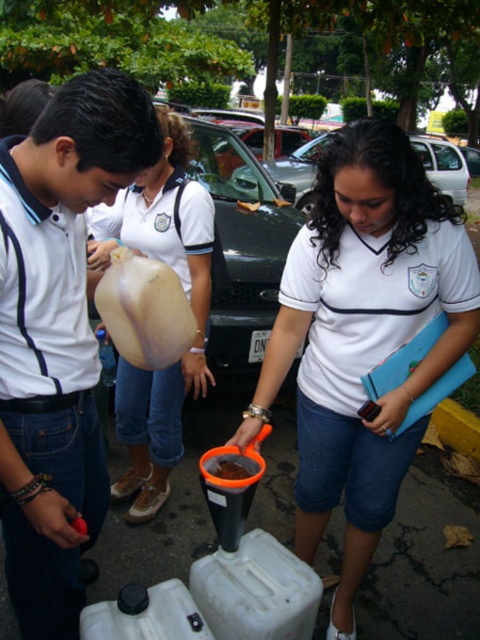
Is white matte shirt at center to the right of matte white balloon at center from the viewer's perspective?

Correct, you'll find white matte shirt at center to the right of matte white balloon at center.

Does point (406, 460) come farther from viewer compared to point (171, 458)?

No, (406, 460) is in front of (171, 458).

Is point (372, 209) closer to camera compared to point (189, 364)?

That is True.

This screenshot has width=480, height=640. Identify the location of white matte shirt at center. tap(362, 337).

Does point (464, 200) come behind point (249, 467)?

That is True.

Where is `metallic silver car at center`? The height and width of the screenshot is (640, 480). metallic silver car at center is located at coordinates (444, 164).

Image resolution: width=480 pixels, height=640 pixels. Find the location of `metallic silver car at center`. metallic silver car at center is located at coordinates (444, 164).

Does matte white balloon at center have a lesser width compared to translucent rubber balloon at center?

In fact, matte white balloon at center might be wider than translucent rubber balloon at center.

Which is behind, point (163, 125) or point (120, 348)?

The point (163, 125) is behind.

Find the location of a particular element. matte white balloon at center is located at coordinates (187, 298).